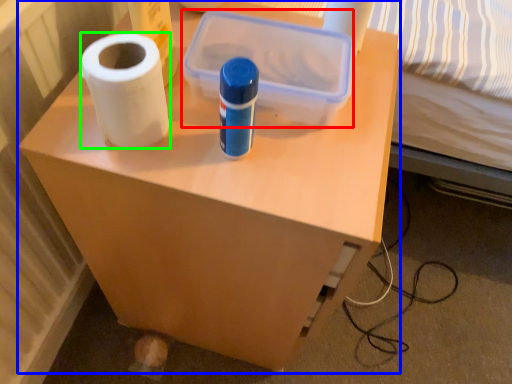
Question: Estimate the real-world distances between objects in this image. Which object is farther from storage box (highlighted by a red box), furniture (highlighted by a blue box) or paper towel (highlighted by a green box)?

Choices:
 (A) furniture
 (B) paper towel

Answer: (A)